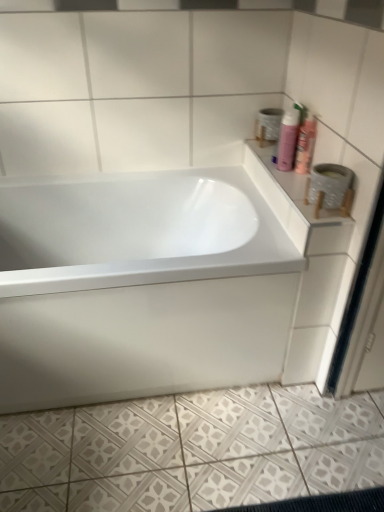
Where is `free space above white glossy counter top at upper right (from a real-world perspective)`? This screenshot has width=384, height=512. free space above white glossy counter top at upper right (from a real-world perspective) is located at coordinates (284, 170).